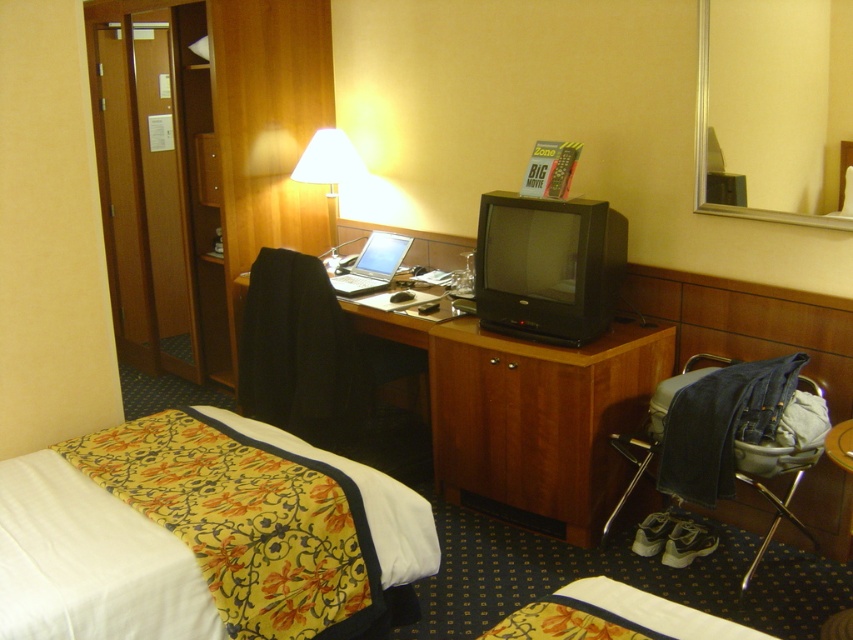
Question: Does black fabric chair at center lie behind denim fabric chair at lower right?

Choices:
 (A) no
 (B) yes

Answer: (B)

Question: Does wooden desk at left have a greater width compared to wooden drawer at center?

Choices:
 (A) no
 (B) yes

Answer: (B)

Question: Among these points, which one is nearest to the camera?

Choices:
 (A) (334, 173)
 (B) (320, 248)

Answer: (A)

Question: Based on their relative distances, which object is nearer to the white fabric lampshade at upper center?

Choices:
 (A) silver metallic laptop at center
 (B) wooden drawer at center

Answer: (A)

Question: Among these objects, which one is nearest to the camera?

Choices:
 (A) wooden drawer at center
 (B) woodendesk at center

Answer: (B)

Question: Is wooden desk at left bigger than denim fabric chair at lower right?

Choices:
 (A) yes
 (B) no

Answer: (A)